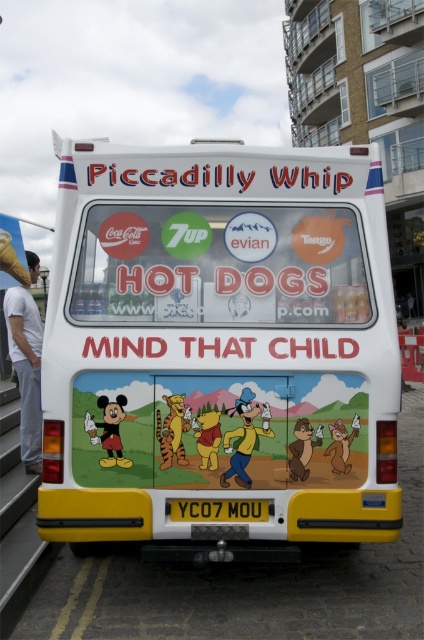
Consider the image. Between white plastic food truck at center and yellow/yellowish plastic at center, which one is positioned lower?

yellow/yellowish plastic at center

Who is taller, white plastic food truck at center or yellow/yellowish plastic at center?

white plastic food truck at center

Identify the location of white plastic food truck at center. (220, 348).